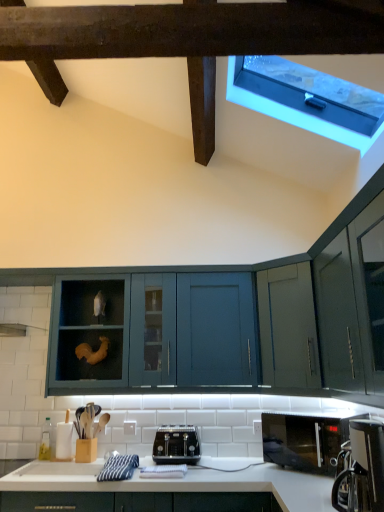
Question: Should I look upward or downward to see black plastic coffee machine at lower right?

Choices:
 (A) up
 (B) down

Answer: (B)

Question: Does black matte microwave at lower right have a greater height compared to black metallic toaster at center?

Choices:
 (A) no
 (B) yes

Answer: (B)

Question: Is black matte microwave at lower right not inside black metallic toaster at center?

Choices:
 (A) yes
 (B) no

Answer: (A)

Question: From the image's perspective, would you say black matte microwave at lower right is positioned over black metallic toaster at center?

Choices:
 (A) yes
 (B) no

Answer: (A)

Question: Is black matte microwave at lower right turned away from black metallic toaster at center?

Choices:
 (A) no
 (B) yes

Answer: (A)

Question: Can you confirm if black matte microwave at lower right is wider than black metallic toaster at center?

Choices:
 (A) yes
 (B) no

Answer: (A)

Question: Is black matte microwave at lower right placed right next to black metallic toaster at center?

Choices:
 (A) no
 (B) yes

Answer: (A)

Question: Considering the relative sizes of teal matte cabinet at center and black matte microwave at lower right in the image provided, is teal matte cabinet at center wider than black matte microwave at lower right?

Choices:
 (A) yes
 (B) no

Answer: (B)

Question: Is teal matte cabinet at center located outside black matte microwave at lower right?

Choices:
 (A) yes
 (B) no

Answer: (A)

Question: Is teal matte cabinet at center at the left side of black matte microwave at lower right?

Choices:
 (A) no
 (B) yes

Answer: (B)

Question: Is teal matte cabinet at center shorter than black matte microwave at lower right?

Choices:
 (A) no
 (B) yes

Answer: (A)

Question: Considering the relative sizes of teal matte cabinet at center and black matte microwave at lower right in the image provided, is teal matte cabinet at center smaller than black matte microwave at lower right?

Choices:
 (A) no
 (B) yes

Answer: (A)

Question: Is teal matte cabinet at center directly adjacent to black matte microwave at lower right?

Choices:
 (A) no
 (B) yes

Answer: (A)

Question: Is black matte microwave at lower right oriented away from transparent plastic window at upper right?

Choices:
 (A) no
 (B) yes

Answer: (A)